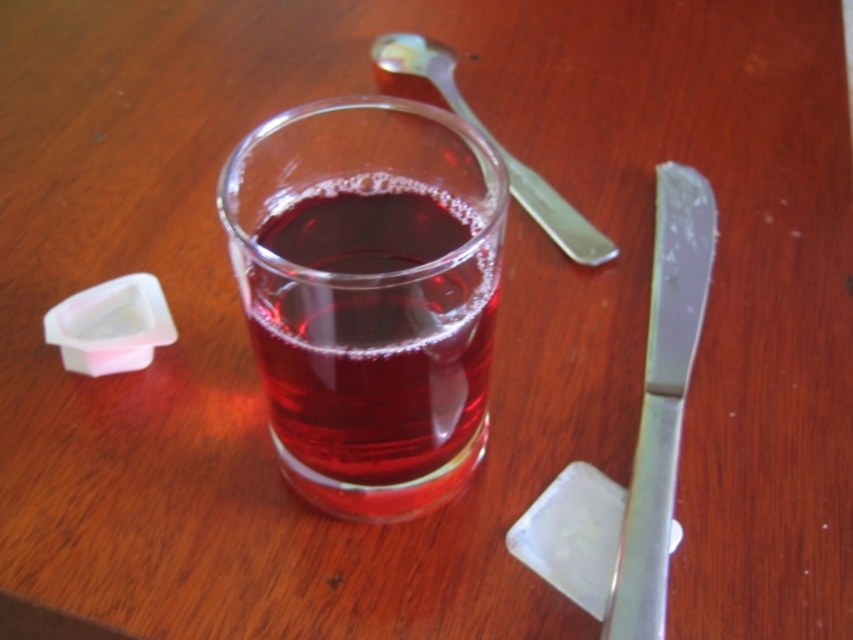
Does translucent glass beverage at center have a smaller size compared to silver metallic spoon at upper center?

Yes.

Can you confirm if translucent glass beverage at center is positioned to the left of silver metallic spoon at upper center?

Yes, translucent glass beverage at center is to the left of silver metallic spoon at upper center.

Between point (364, 404) and point (519, 200), which one is positioned in front?

Positioned in front is point (364, 404).

Image resolution: width=853 pixels, height=640 pixels. I want to click on translucent glass beverage at center, so click(x=376, y=360).

Can you confirm if polished metal butter knife at right is wider than silver metallic spoon at upper center?

No, polished metal butter knife at right is not wider than silver metallic spoon at upper center.

Which is in front, point (671, 388) or point (566, 228)?

Point (671, 388) is in front.

I want to click on polished metal butter knife at right, so click(x=662, y=397).

Can you confirm if translucent glass beverage at center is wider than polished metal butter knife at right?

Correct, the width of translucent glass beverage at center exceeds that of polished metal butter knife at right.

Based on the photo, can you confirm if translucent glass beverage at center is shorter than polished metal butter knife at right?

Correct, translucent glass beverage at center is not as tall as polished metal butter knife at right.

Is point (270, 253) positioned in front of point (647, 484)?

Yes.

This screenshot has width=853, height=640. I want to click on translucent glass beverage at center, so click(376, 360).